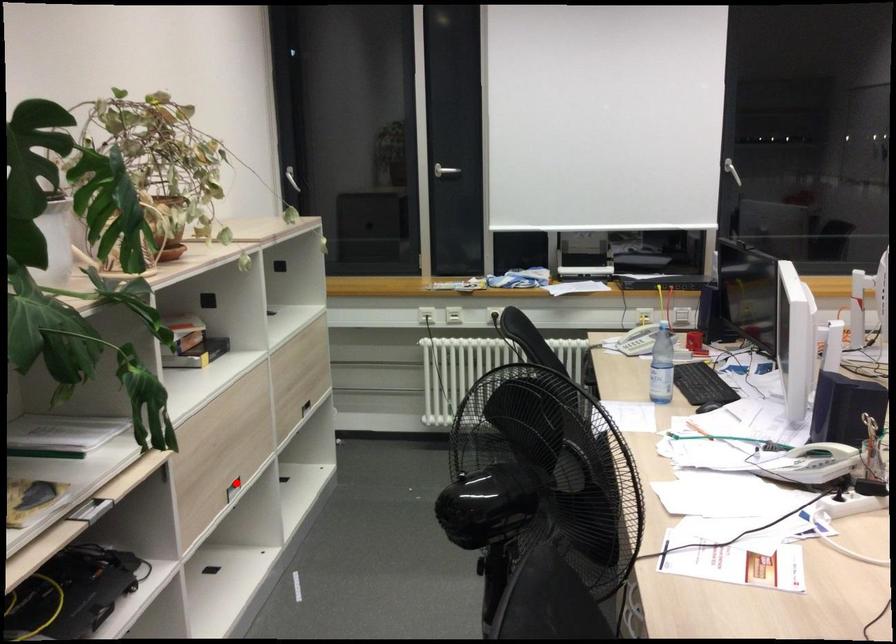
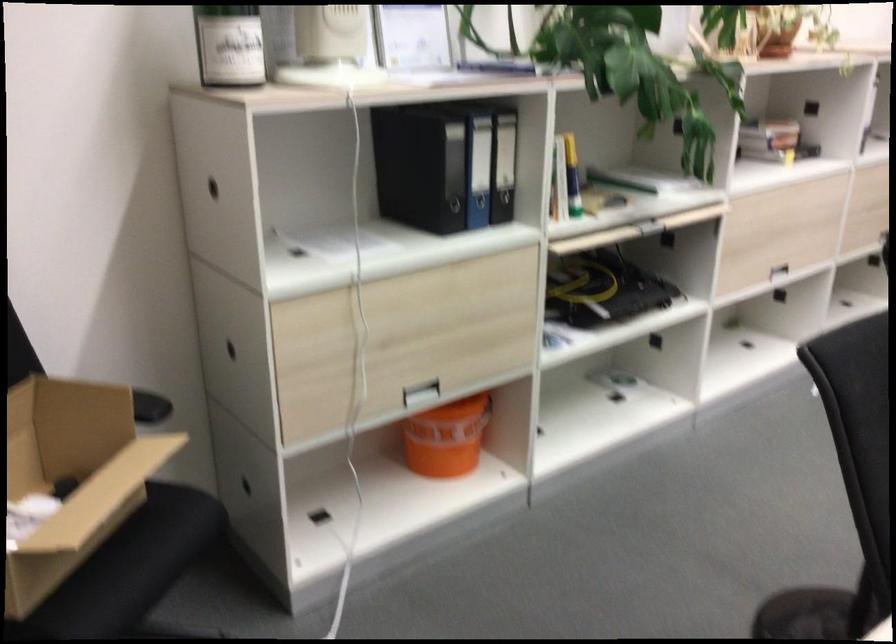
Question: I am providing you with two images of the same scene from different viewpoints. Given a red point in image1, look at the same physical point in image2. Is it:

Choices:
 (A) Closer to the viewpoint
 (B) Farther from the viewpoint

Answer: (B)